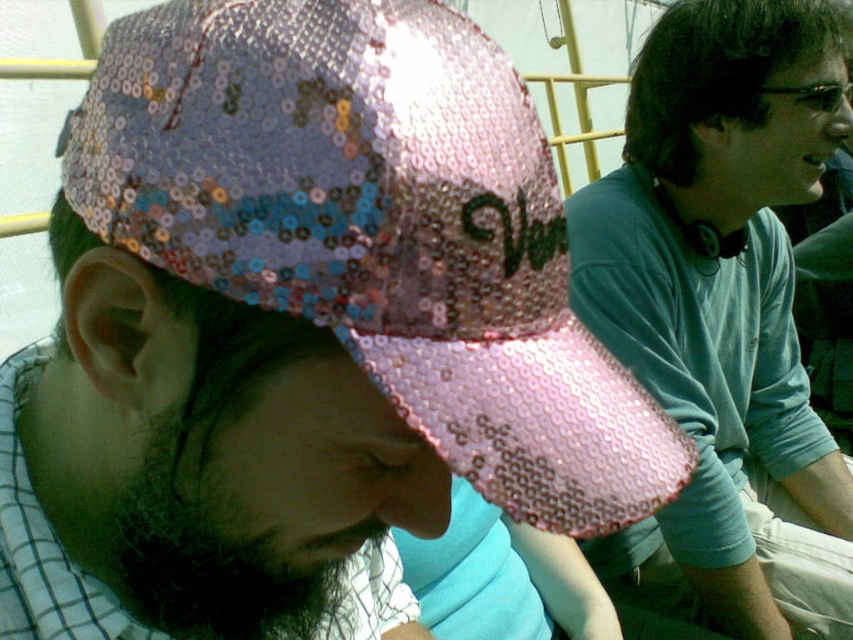
You are a photographer trying to capture a closeup shot of the pink sequined baseball cap at center. The camera you have can only focus on objects within 10 inches. Can you take the photo without moving closer?

The photographer is 12.24 inches away from the pink sequined baseball cap at center, which is beyond the camera focus range of 10 inches. Therefore, the photographer cannot take the photo without moving closer.